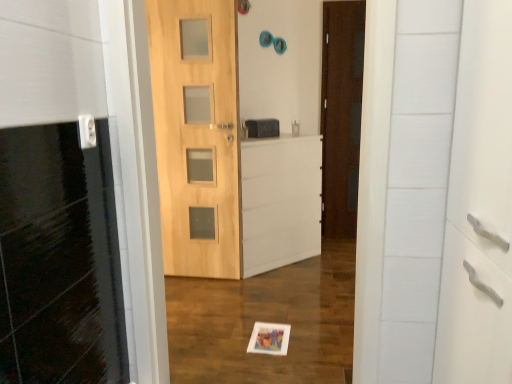
In order to face dark brown wood door at center, arranged as the 2th door when viewed from the left, should I rotate leftwards or rightwards?

You should look right and rotate roughly 11.579 degrees.

Image resolution: width=512 pixels, height=384 pixels. Describe the element at coordinates (280, 202) in the screenshot. I see `white matte file cabinet at center` at that location.

Describe the element at coordinates (262, 128) in the screenshot. I see `matte black medicine cabinet at center` at that location.

Identify the location of matte black medicine cabinet at center. [x=262, y=128].

This screenshot has width=512, height=384. Find the location of `white plastic electric outlet at upper left`. white plastic electric outlet at upper left is located at coordinates (87, 132).

From the image's perspective, which one is positioned higher, white plastic electric outlet at upper left or white matte file cabinet at center?

white plastic electric outlet at upper left is shown above in the image.

Can we say white plastic electric outlet at upper left lies outside white matte file cabinet at center?

white plastic electric outlet at upper left lies outside white matte file cabinet at center's area.

Between point (81, 132) and point (309, 143), which one is positioned behind?

The point (309, 143) is farther.

Considering the points (249, 123) and (79, 139), which point is behind, point (249, 123) or point (79, 139)?

Positioned behind is point (249, 123).

In the image, is matte black medicine cabinet at center on the left side or the right side of white plastic electric outlet at upper left?

From the image, it's evident that matte black medicine cabinet at center is to the right of white plastic electric outlet at upper left.

Is matte black medicine cabinet at center positioned far away from white plastic electric outlet at upper left?

Yes, matte black medicine cabinet at center is far from white plastic electric outlet at upper left.

From the image's perspective, is matte black medicine cabinet at center positioned above or below white plastic electric outlet at upper left?

matte black medicine cabinet at center is situated higher than white plastic electric outlet at upper left in the image.

Is matte black medicine cabinet at center inside or outside of dark brown wood door at center, the second door in the front-to-back sequence?

matte black medicine cabinet at center is not enclosed by dark brown wood door at center, the second door in the front-to-back sequence.

Who is smaller, matte black medicine cabinet at center or dark brown wood door at center, arranged as the 2th door when viewed from the left?

matte black medicine cabinet at center.

Is matte black medicine cabinet at center shorter than dark brown wood door at center, the second door in the front-to-back sequence?

Yes.

From the picture: Is matte black medicine cabinet at center turned away from natural wood door at center, acting as the 1th door starting from the left?

No, matte black medicine cabinet at center is not facing away from natural wood door at center, acting as the 1th door starting from the left.

Between matte black medicine cabinet at center and natural wood door at center, the 2th door from the back, which one has less height?

matte black medicine cabinet at center.

Looking at this image, can you tell me how much matte black medicine cabinet at center and natural wood door at center, marked as the 2th door in a right-to-left arrangement, differ in facing direction?

matte black medicine cabinet at center and natural wood door at center, marked as the 2th door in a right-to-left arrangement, are facing 48.2 degrees away from each other.

Which of these two, matte black medicine cabinet at center or natural wood door at center, which is counted as the 1th door, starting from the front, is smaller?

Smaller between the two is matte black medicine cabinet at center.

What are the coordinates of `the 2nd door directly beneath the white plastic electric outlet at upper left (from a real-world perspective)` in the screenshot? It's located at (197, 134).

Considering the sizes of natural wood door at center, which is counted as the 1th door, starting from the front, and white plastic electric outlet at upper left in the image, is natural wood door at center, which is counted as the 1th door, starting from the front, wider or thinner than white plastic electric outlet at upper left?

Clearly, natural wood door at center, which is counted as the 1th door, starting from the front, has more width compared to white plastic electric outlet at upper left.

Is natural wood door at center, which is counted as the 1th door, starting from the front, positioned with its back to white plastic electric outlet at upper left?

No, white plastic electric outlet at upper left is not at the back of natural wood door at center, which is counted as the 1th door, starting from the front.

Is natural wood door at center, which is counted as the 1th door, starting from the front, not close to white plastic electric outlet at upper left?

Indeed, natural wood door at center, which is counted as the 1th door, starting from the front, is not near white plastic electric outlet at upper left.

Would you say white plastic electric outlet at upper left is a long distance from matte black medicine cabinet at center?

white plastic electric outlet at upper left is positioned a significant distance from matte black medicine cabinet at center.

Is white plastic electric outlet at upper left at the right side of matte black medicine cabinet at center?

In fact, white plastic electric outlet at upper left is to the left of matte black medicine cabinet at center.

Would you say white plastic electric outlet at upper left is inside or outside matte black medicine cabinet at center?

white plastic electric outlet at upper left lies outside matte black medicine cabinet at center.

In the scene shown: Is white plastic electric outlet at upper left turned away from matte black medicine cabinet at center?

No, white plastic electric outlet at upper left is not facing away from matte black medicine cabinet at center.

How much distance is there between dark brown wood door at center, arranged as the 2th door when viewed from the left, and natural wood door at center, marked as the 2th door in a right-to-left arrangement?

4.15 feet.

How many degrees apart are the facing directions of dark brown wood door at center, which ranks as the first door in back-to-front order, and natural wood door at center, the 2th door from the back?

There is a 3.14-degree angle between the facing directions of dark brown wood door at center, which ranks as the first door in back-to-front order, and natural wood door at center, the 2th door from the back.

Would you consider dark brown wood door at center, which ranks as the first door in back-to-front order, to be distant from natural wood door at center, acting as the 1th door starting from the left?

That's right, there is a large distance between dark brown wood door at center, which ranks as the first door in back-to-front order, and natural wood door at center, acting as the 1th door starting from the left.

Can you confirm if dark brown wood door at center, which ranks as the first door in back-to-front order, is positioned to the left of natural wood door at center, the 2th door from the back?

No, dark brown wood door at center, which ranks as the first door in back-to-front order, is not to the left of natural wood door at center, the 2th door from the back.

Locate an element on the screen. This screenshot has width=512, height=384. file cabinet directly beneath the white plastic electric outlet at upper left (from a real-world perspective) is located at coordinates (280, 202).

This screenshot has width=512, height=384. Identify the location of medicine cabinet on the right of white plastic electric outlet at upper left. (262, 128).

Looking at the image, which one is located further to dark brown wood door at center, arranged as the 2th door when viewed from the left, white matte file cabinet at center or white plastic electric outlet at upper left?

white plastic electric outlet at upper left is further to dark brown wood door at center, arranged as the 2th door when viewed from the left.

Looking at the image, which one is located further to white plastic electric outlet at upper left, matte black medicine cabinet at center or natural wood door at center, the 2th door from the back?

matte black medicine cabinet at center is further to white plastic electric outlet at upper left.

From the image, which object appears to be farther from natural wood door at center, acting as the 1th door starting from the left, white plastic electric outlet at upper left or white matte file cabinet at center?

Among the two, white plastic electric outlet at upper left is located further to natural wood door at center, acting as the 1th door starting from the left.

Based on their spatial positions, is white plastic electric outlet at upper left or matte black medicine cabinet at center closer to dark brown wood door at center, acting as the first door starting from the right?

matte black medicine cabinet at center is closer to dark brown wood door at center, acting as the first door starting from the right.

When comparing their distances from dark brown wood door at center, acting as the first door starting from the right, does white matte file cabinet at center or matte black medicine cabinet at center seem further?

matte black medicine cabinet at center.

Which object lies nearer to the anchor point white plastic electric outlet at upper left, white matte file cabinet at center or dark brown wood door at center, acting as the first door starting from the right?

white matte file cabinet at center lies closer to white plastic electric outlet at upper left than the other object.

When comparing their distances from natural wood door at center, which is counted as the 1th door, starting from the front, does dark brown wood door at center, which ranks as the first door in back-to-front order, or matte black medicine cabinet at center seem further?

dark brown wood door at center, which ranks as the first door in back-to-front order, lies further to natural wood door at center, which is counted as the 1th door, starting from the front, than the other object.

Looking at this image, looking at the image, which one is located closer to white matte file cabinet at center, dark brown wood door at center, arranged as the 2th door when viewed from the left, or matte black medicine cabinet at center?

matte black medicine cabinet at center lies closer to white matte file cabinet at center than the other object.

Find the location of a particular element. This screenshot has height=384, width=512. door between white plastic electric outlet at upper left and matte black medicine cabinet at center from front to back is located at coordinates (197, 134).

At what (x,y) coordinates should I click in order to perform the action: click on file cabinet between white plastic electric outlet at upper left and matte black medicine cabinet at center from front to back. Please return your answer as a coordinate pair (x, y). The width and height of the screenshot is (512, 384). Looking at the image, I should click on tap(280, 202).

Locate an element on the screen. The image size is (512, 384). door positioned between white plastic electric outlet at upper left and dark brown wood door at center, the second door in the front-to-back sequence, from near to far is located at coordinates (197, 134).

The image size is (512, 384). In order to click on medicine cabinet located between white plastic electric outlet at upper left and dark brown wood door at center, which ranks as the first door in back-to-front order, in the depth direction in this screenshot , I will do `click(262, 128)`.